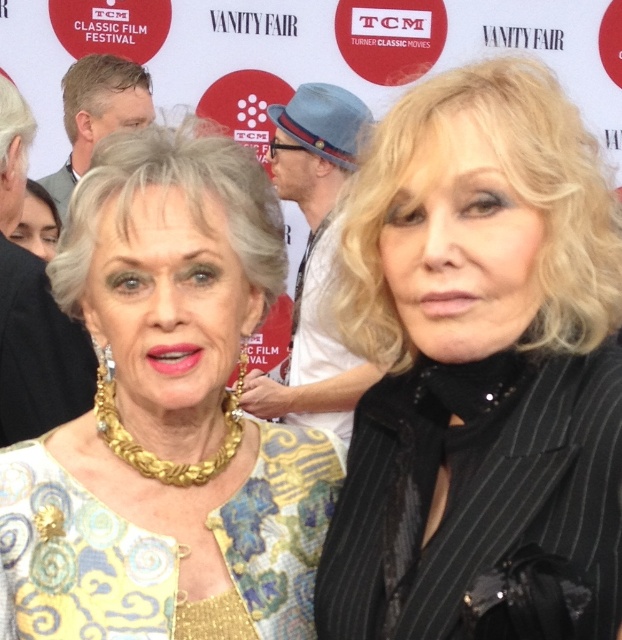
Based on the photo, can you confirm if gold textured necklace at center is shorter than gray hair at upper left?

No.

Does point (330, 452) lie in front of point (88, 109)?

That is True.

Find the location of a particular element. gold textured necklace at center is located at coordinates (167, 417).

Which is above, gold textured necklace at center or blue felt hat at center?

blue felt hat at center is above.

Identify the location of gold textured necklace at center. (167, 417).

The height and width of the screenshot is (640, 622). I want to click on gold textured necklace at center, so click(167, 417).

This screenshot has height=640, width=622. What are the coordinates of `gold textured necklace at center` in the screenshot? It's located at [167, 417].